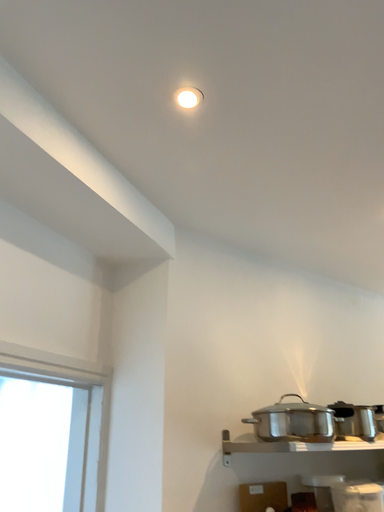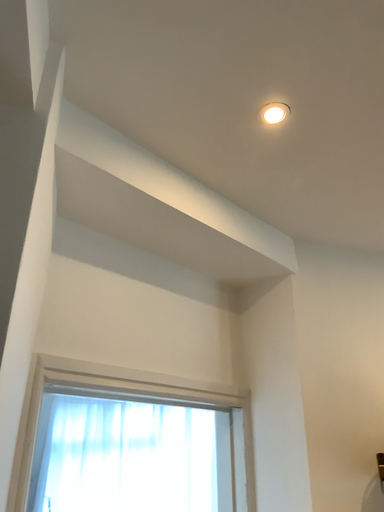
Question: Which way did the camera rotate in the video?

Choices:
 (A) rotated right
 (B) rotated left

Answer: (B)